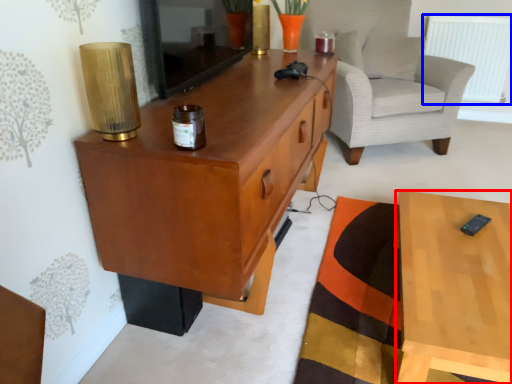
Question: Among these objects, which one is farthest to the camera, desk (highlighted by a red box) or radiator (highlighted by a blue box)?

Choices:
 (A) desk
 (B) radiator

Answer: (B)